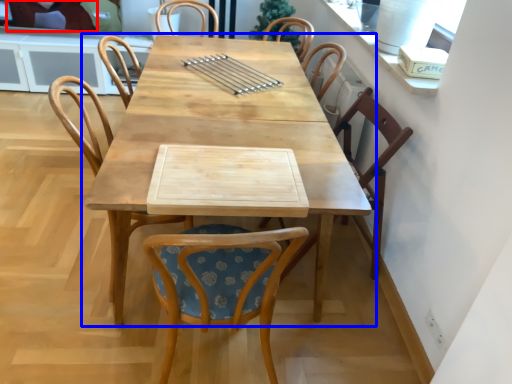
Question: Among these objects, which one is nearest to the camera, couple (highlighted by a red box) or table (highlighted by a blue box)?

Choices:
 (A) couple
 (B) table

Answer: (B)